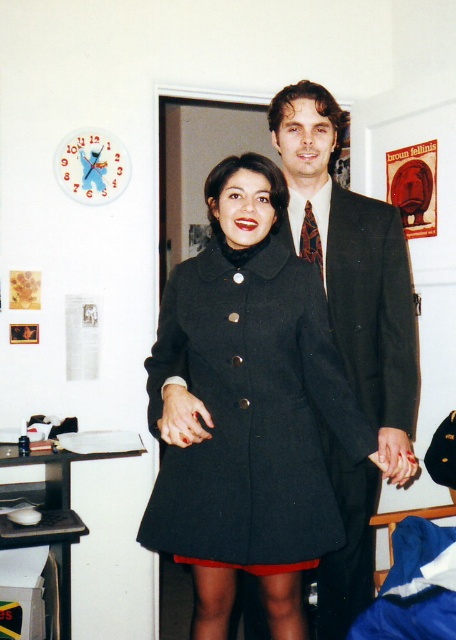
Question: Does matte black coat at center have a larger size compared to dark wool suit at center?

Choices:
 (A) yes
 (B) no

Answer: (B)

Question: Does matte black coat at center appear on the right side of dark wool suit at center?

Choices:
 (A) yes
 (B) no

Answer: (B)

Question: Which object appears farthest from the camera in this image?

Choices:
 (A) dark wool suit at center
 (B) matte black coat at center

Answer: (A)

Question: Can you confirm if matte black coat at center is thinner than dark wool suit at center?

Choices:
 (A) yes
 (B) no

Answer: (B)

Question: Among these points, which one is farthest from the camera?

Choices:
 (A) (342, 252)
 (B) (263, 381)

Answer: (A)